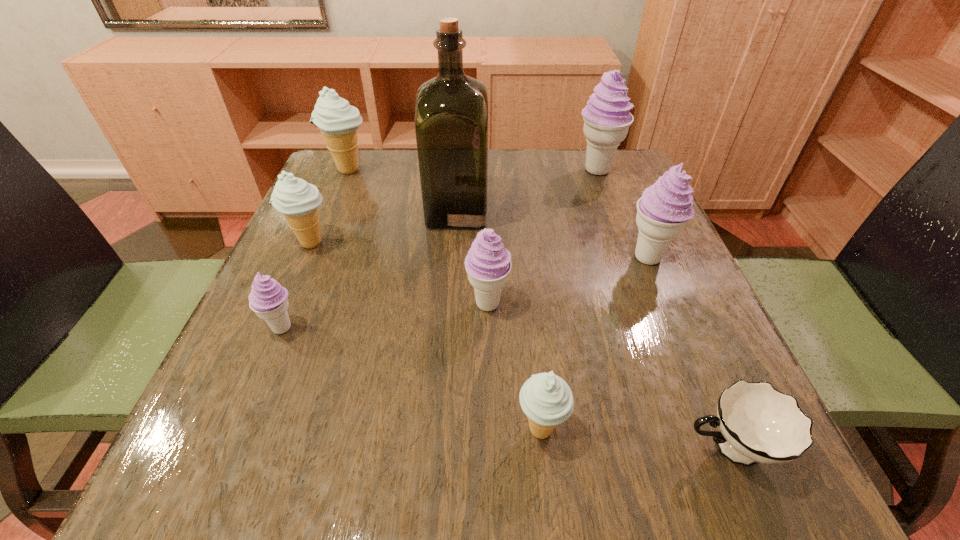
Locate an element on the screen. This screenshot has height=540, width=960. free space between the farthest beige icecream and the second nearest beige icecream is located at coordinates (329, 206).

Locate an element on the screen. Image resolution: width=960 pixels, height=540 pixels. unoccupied position between the second smallest purple icecream and the nearest icecream is located at coordinates (515, 366).

At what (x,y) coordinates should I click in order to perform the action: click on free space between the third smallest purple icecream and the tallest icecream. Please return your answer as a coordinate pair (x, y). Looking at the image, I should click on (622, 214).

Where is `unoccupied position between the second farthest beige icecream and the smallest beige icecream`? The height and width of the screenshot is (540, 960). unoccupied position between the second farthest beige icecream and the smallest beige icecream is located at coordinates (426, 336).

You are a GUI agent. You are given a task and a screenshot of the screen. Output one action in this format:
    pyautogui.click(x=<x>, y=<y>)
    Task: Click on the free area in between the biggest beige icecream and the smallest purple icecream
    
    Given the screenshot: What is the action you would take?
    pyautogui.click(x=315, y=249)

Image resolution: width=960 pixels, height=540 pixels. Find the location of `object that is the fifth nearest to the second tallest object`. object that is the fifth nearest to the second tallest object is located at coordinates (296, 199).

Where is `object that is the sixth closest to the third purple icecream from right to left`? Image resolution: width=960 pixels, height=540 pixels. object that is the sixth closest to the third purple icecream from right to left is located at coordinates (296, 199).

I want to click on icecream that stands as the closest to the second purple icecream from left to right, so click(546, 399).

Point out which icecream is positioned as the second nearest to the farthest beige icecream. Please provide its 2D coordinates. Your answer should be formatted as a tuple, i.e. [(x, y)], where the tuple contains the x and y coordinates of a point satisfying the conditions above.

[(268, 299)]

You are a GUI agent. You are given a task and a screenshot of the screen. Output one action in this format:
    pyautogui.click(x=<x>, y=<y>)
    Task: Click on the purple icecream that is the closest to the leftmost purple icecream
    
    Given the screenshot: What is the action you would take?
    pyautogui.click(x=488, y=264)